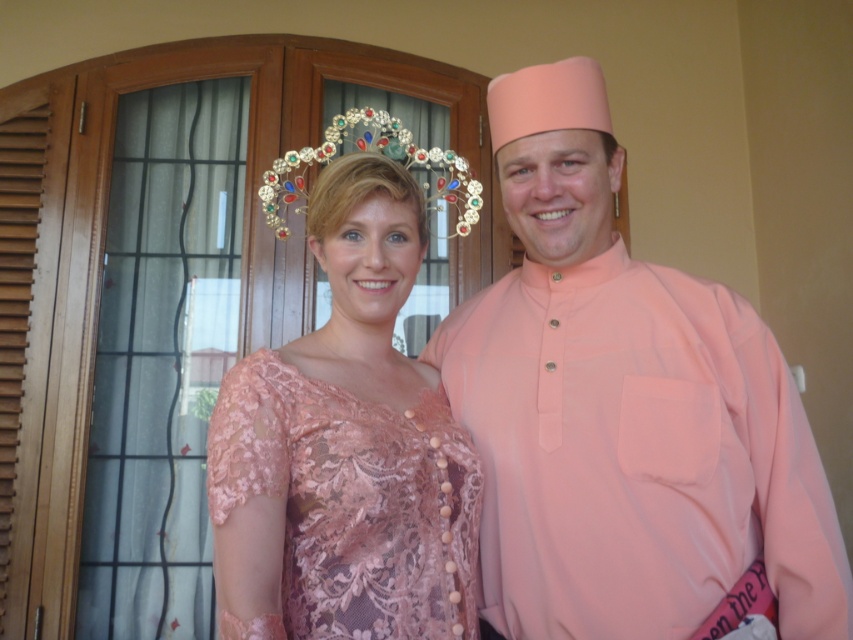
Question: Is lace fabric dress at center to the right of multicolored jeweled tiara at upper center from the viewer's perspective?

Choices:
 (A) no
 (B) yes

Answer: (B)

Question: Which of these objects is positioned farthest from the lace fabric dress at center?

Choices:
 (A) multicolored jeweled tiara at upper center
 (B) matte peach shirt at center

Answer: (A)

Question: Estimate the real-world distances between objects in this image. Which object is closer to the multicolored jeweled tiara at upper center?

Choices:
 (A) lace fabric dress at center
 (B) matte peach shirt at center

Answer: (B)

Question: Which of the following is the farthest from the observer?

Choices:
 (A) multicolored jeweled tiara at upper center
 (B) lace fabric dress at center

Answer: (A)

Question: Does matte peach shirt at center come behind lace fabric dress at center?

Choices:
 (A) yes
 (B) no

Answer: (A)

Question: Can you confirm if matte peach shirt at center is smaller than multicolored jeweled tiara at upper center?

Choices:
 (A) yes
 (B) no

Answer: (A)